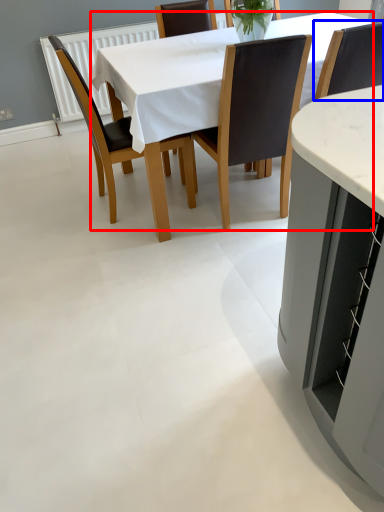
Question: Which point is further to the camera, kitchen & dining room table (highlighted by a red box) or chair (highlighted by a blue box)?

Choices:
 (A) kitchen & dining room table
 (B) chair

Answer: (B)